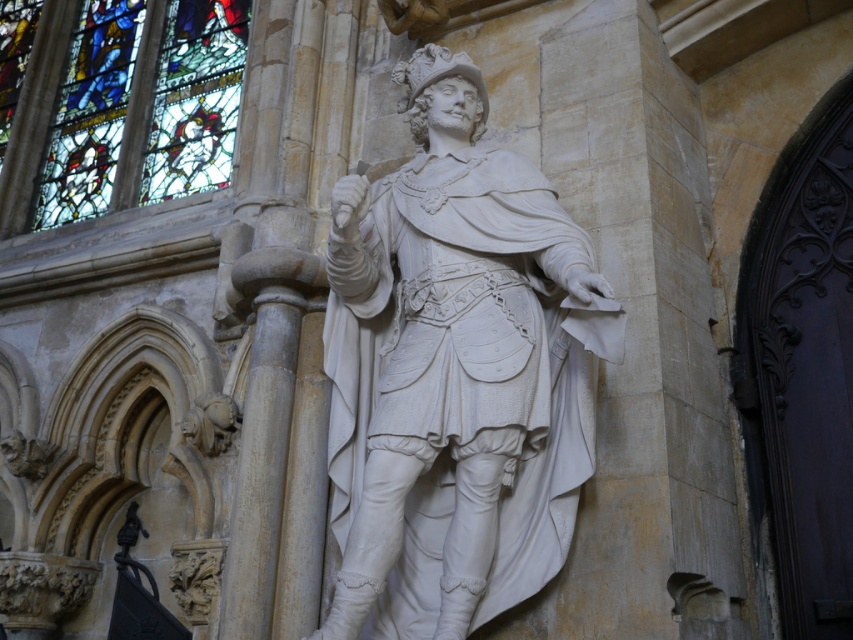
You are an architect designing a new museum exhibit and need to ensure that the white marble statue at center and the stained glass window at upper left are positioned so that the statue does not block the view of the window. Based on their sizes, can you confirm if the statue is small enough to avoid blocking the window?

The white marble statue at center is much taller than the stained glass window at upper left, so it might block the view of the window if positioned directly in front of it. Adjust the placement to ensure the statue does not obscure the window.

Consider the image. You are an architect designing a new plaza and want to place a bench so that it is directly to the right of the white marble statue at center. Based on the statue location at point 0.583, 0.535, where should the bench be placed?

The bench should be placed to the right of the white marble statue at center, which is located at point (x=456, y=372). Since the bench needs to be directly to the right, its coordinates would be higher in the x or horizontal axis. For example, if the statue is at x 0.583, moving right would increase the x value, so the bench could be placed at approximately (x=456, y=436). However, the exact placement may depend on the plaza layout and available space.

What is located at the coordinates point [456,372] in the image?

The point [456,372] marks the location of the white marble statue at center.